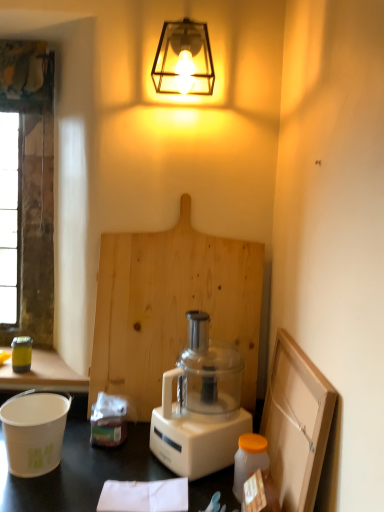
You are a GUI agent. You are given a task and a screenshot of the screen. Output one action in this format:
    pyautogui.click(x=<x>, y=<y>)
    Task: Click on the metallic yellow canister at left, placed as the 2th appliance when sorted from bottom to top
    
    Given the screenshot: What is the action you would take?
    pyautogui.click(x=21, y=354)

Find the location of a particular element. This screenshot has height=512, width=384. metallic cage at upper center is located at coordinates (184, 59).

The width and height of the screenshot is (384, 512). I want to click on translucent plastic bag at lower left, so click(x=108, y=421).

Between translucent plastic bag at lower left and metallic yellow canister at left, acting as the first appliance starting from the back, which one has more height?

translucent plastic bag at lower left.

Could you measure the distance between translucent plastic bag at lower left and metallic yellow canister at left, acting as the first appliance starting from the back?

A distance of 43.39 centimeters exists between translucent plastic bag at lower left and metallic yellow canister at left, acting as the first appliance starting from the back.

Consider the image. Between translucent plastic bag at lower left and metallic yellow canister at left, acting as the first appliance starting from the back, which one appears on the right side from the viewer's perspective?

translucent plastic bag at lower left.

Is translucent plastic bag at lower left aimed at metallic yellow canister at left, the 2th appliance viewed from the front?

No, translucent plastic bag at lower left is not turned towards metallic yellow canister at left, the 2th appliance viewed from the front.

Is translucent plastic jar at lower right inside or outside of metallic yellow canister at left, the 2th appliance viewed from the front?

translucent plastic jar at lower right is outside metallic yellow canister at left, the 2th appliance viewed from the front.

Considering the relative positions of translucent plastic jar at lower right and metallic yellow canister at left, the first appliance when ordered from top to bottom, in the image provided, is translucent plastic jar at lower right to the left or to the right of metallic yellow canister at left, the first appliance when ordered from top to bottom,?

From the image, it's evident that translucent plastic jar at lower right is to the right of metallic yellow canister at left, the first appliance when ordered from top to bottom.

Does translucent plastic jar at lower right turn towards metallic yellow canister at left, acting as the first appliance starting from the back?

No, translucent plastic jar at lower right does not turn towards metallic yellow canister at left, acting as the first appliance starting from the back.

From their relative heights in the image, would you say translucent plastic jar at lower right is taller or shorter than metallic yellow canister at left, the 2th appliance viewed from the front?

Clearly, translucent plastic jar at lower right is taller compared to metallic yellow canister at left, the 2th appliance viewed from the front.

Based on the photo, what's the angular difference between translucent plastic jar at lower right and metallic cage at upper center's facing directions?

translucent plastic jar at lower right and metallic cage at upper center are facing 1.08 degrees away from each other.

From the image's perspective, which is above, translucent plastic jar at lower right or metallic cage at upper center?

From the image's view, metallic cage at upper center is above.

Does translucent plastic jar at lower right touch metallic cage at upper center?

They are not placed beside each other.

Between point (243, 438) and point (181, 46), which one is positioned behind?

The point (181, 46) is farther.

Can you confirm if metallic cage at upper center is thinner than glass window screen at left?

No.

Is point (164, 48) closer to viewer compared to point (22, 48)?

Yes, point (164, 48) is closer to viewer.

Looking at this image, is metallic cage at upper center positioned with its back to glass window screen at left?

No, metallic cage at upper center is not facing away from glass window screen at left.

Is metallic cage at upper center taller than glass window screen at left?

In fact, metallic cage at upper center may be shorter than glass window screen at left.

Is glass window screen at left behind white plastic blender at center?

Yes, glass window screen at left is behind white plastic blender at center.

From the image's perspective, who appears lower, glass window screen at left or white plastic blender at center?

white plastic blender at center.

How much distance is there between glass window screen at left and white plastic blender at center?

glass window screen at left is 35.95 inches away from white plastic blender at center.

In the scene shown: Can we say glass window screen at left lies outside white plastic blender at center?

Indeed, glass window screen at left is completely outside white plastic blender at center.

Who is bigger, white plastic blender at center or natural wood cutting board at center?

Bigger between the two is white plastic blender at center.

Can you confirm if white plastic blender at center is taller than natural wood cutting board at center?

In fact, white plastic blender at center may be shorter than natural wood cutting board at center.

From the image's perspective, is white plastic blender at center on natural wood cutting board at center?

Incorrect, from the image's perspective, white plastic blender at center is lower than natural wood cutting board at center.

Which object is closer to the camera, white plastic blender at center or natural wood cutting board at center?

white plastic blender at center.

The height and width of the screenshot is (512, 384). I want to click on blender below the glass window screen at left (from the image's perspective), so click(200, 406).

Considering the relative sizes of white plastic blender at center and glass window screen at left in the image provided, is white plastic blender at center taller than glass window screen at left?

In fact, white plastic blender at center may be shorter than glass window screen at left.

Between point (206, 342) and point (48, 81), which one is positioned in front?

Point (206, 342)

In the image, is white plastic blender at center positioned in front of or behind glass window screen at left?

Clearly, white plastic blender at center is in front of glass window screen at left.

From a real-world perspective, count 2nd appliances upward from the translucent plastic bag at lower left and point to it. Please provide its 2D coordinates.

[(21, 354)]

Identify the location of bottle on the right of metallic yellow canister at left, marked as the 2th appliance in a right-to-left arrangement. This screenshot has height=512, width=384. (249, 460).

From the image, which object appears to be nearer to metallic yellow canister at left, placed as the 2th appliance when sorted from bottom to top, natural wood cutting board at center or metallic cage at upper center?

natural wood cutting board at center is positioned closer to the anchor metallic yellow canister at left, placed as the 2th appliance when sorted from bottom to top.

Estimate the real-world distances between objects in this image. Which object is closer to metallic cage at upper center, translucent plastic bag at lower left or white matte bucket at lower left, marked as the 2th appliance in a top-to-bottom arrangement?

Among the two, translucent plastic bag at lower left is located nearer to metallic cage at upper center.

Looking at the image, which one is located further to metallic yellow canister at left, the first appliance when ordered from top to bottom, metallic cage at upper center or white plastic blender at center?

metallic cage at upper center is further to metallic yellow canister at left, the first appliance when ordered from top to bottom.

Consider the image. Based on their spatial positions, is metallic cage at upper center or white plastic blender at center further from glass window screen at left?

Based on the image, white plastic blender at center appears to be further to glass window screen at left.

Which object lies nearer to the anchor point natural wood cutting board at center, glass window screen at left or white matte bucket at lower left, marked as the 2th appliance in a top-to-bottom arrangement?

white matte bucket at lower left, marked as the 2th appliance in a top-to-bottom arrangement, is closer to natural wood cutting board at center.

Estimate the real-world distances between objects in this image. Which object is closer to metallic yellow canister at left, marked as the 2th appliance in a right-to-left arrangement, metallic cage at upper center or translucent plastic bag at lower left?

The object closer to metallic yellow canister at left, marked as the 2th appliance in a right-to-left arrangement, is translucent plastic bag at lower left.

Estimate the real-world distances between objects in this image. Which object is further from natural wood cutting board at center, translucent plastic bag at lower left or translucent plastic jar at lower right?

translucent plastic jar at lower right is positioned further to the anchor natural wood cutting board at center.

Estimate the real-world distances between objects in this image. Which object is closer to glass window screen at left, white plastic blender at center or metallic yellow canister at left, acting as the first appliance starting from the back?

Based on the image, metallic yellow canister at left, acting as the first appliance starting from the back, appears to be nearer to glass window screen at left.

At what (x,y) coordinates should I click in order to perform the action: click on window screen that lies between metallic cage at upper center and translucent plastic jar at lower right from top to bottom. Please return your answer as a coordinate pair (x, y). This screenshot has width=384, height=512. Looking at the image, I should click on (32, 186).

You are a GUI agent. You are given a task and a screenshot of the screen. Output one action in this format:
    pyautogui.click(x=<x>, y=<y>)
    Task: Click on the waste between white matte bucket at lower left, which ranks as the second appliance in left-to-right order, and natural wood cutting board at center, in the horizontal direction
    This screenshot has height=512, width=384.
    Given the screenshot: What is the action you would take?
    pyautogui.click(x=108, y=421)

The height and width of the screenshot is (512, 384). I want to click on plywood between metallic cage at upper center and white matte bucket at lower left, the second appliance from the back, from top to bottom, so click(171, 306).

Locate an element on the screen. The height and width of the screenshot is (512, 384). appliance between glass window screen at left and white matte bucket at lower left, marked as the first appliance in a bottom-to-top arrangement, in the up-down direction is located at coordinates (21, 354).